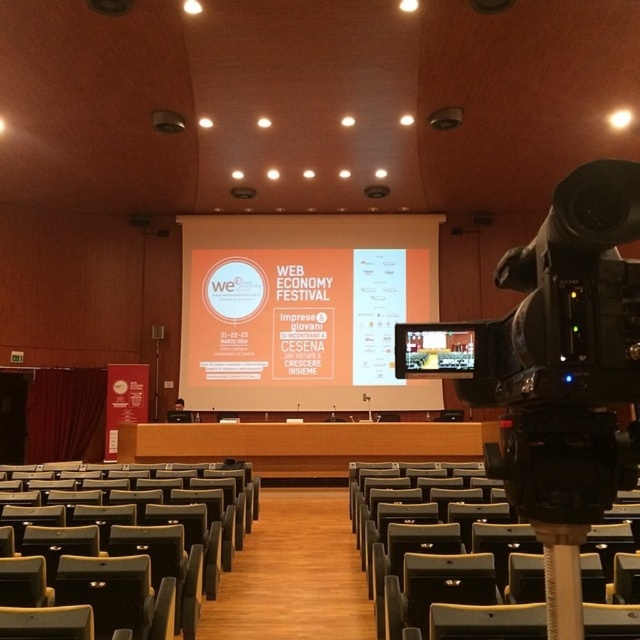
Question: Which of these objects is positioned farthest from the matte gray chair at center?

Choices:
 (A) orange matte projection screen at center
 (B) matte white screen at center
 (C) dark gray leather chair at center

Answer: (A)

Question: Which point is closer to the camera?

Choices:
 (A) orange matte projection screen at center
 (B) matte gray chair at center
 (C) dark gray leather chair at center
 (D) matte white screen at center

Answer: (D)

Question: Is orange matte projection screen at center positioned behind matte white screen at center?

Choices:
 (A) yes
 (B) no

Answer: (A)

Question: Does orange matte projection screen at center have a lesser width compared to matte gray chair at center?

Choices:
 (A) yes
 (B) no

Answer: (B)

Question: Observing the image, what is the correct spatial positioning of orange matte projection screen at center in reference to matte white screen at center?

Choices:
 (A) below
 (B) above

Answer: (B)

Question: Which point is closer to the camera taking this photo?

Choices:
 (A) (426, 339)
 (B) (246, 346)
 (C) (42, 560)
 (D) (452, 541)

Answer: (A)